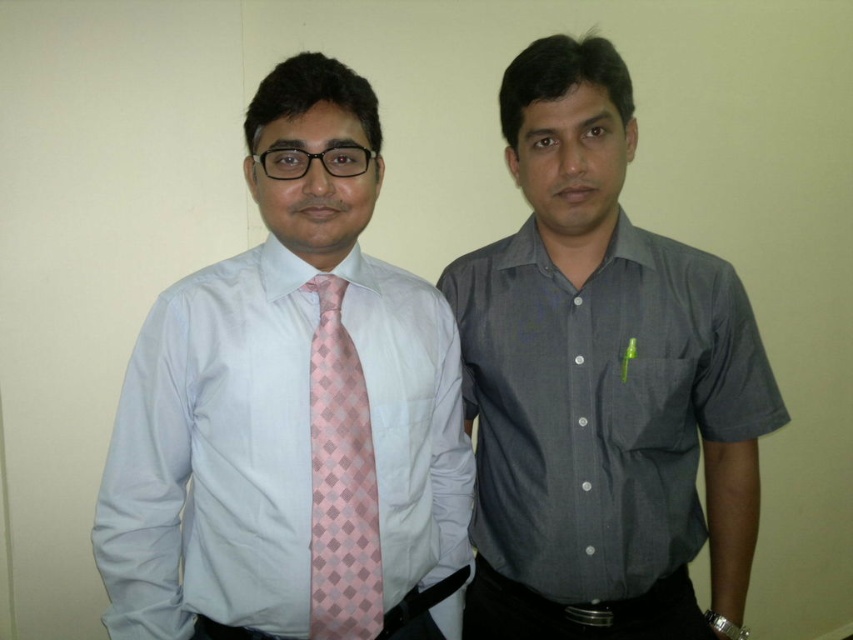
Measure the distance between point (583, 173) and camera.

A distance of 3.53 feet exists between point (583, 173) and camera.

Is dark gray shirt at center thinner than pink silk tie at left?

No, dark gray shirt at center is not thinner than pink silk tie at left.

Between point (692, 500) and point (335, 541), which one is positioned behind?

The point (692, 500) is more distant.

Locate an element on the screen. The height and width of the screenshot is (640, 853). dark gray shirt at center is located at coordinates (601, 385).

Does dark gray shirt at center have a greater width compared to black leather belt at lower center?

Correct, the width of dark gray shirt at center exceeds that of black leather belt at lower center.

Is point (602, 211) closer to viewer compared to point (583, 609)?

Yes.

Locate an element on the screen. dark gray shirt at center is located at coordinates (601, 385).

Can you confirm if matte pink tie at left is wider than black leather belt at lower center?

Correct, the width of matte pink tie at left exceeds that of black leather belt at lower center.

Can you confirm if matte pink tie at left is thinner than black leather belt at lower center?

No, matte pink tie at left is not thinner than black leather belt at lower center.

Which is behind, point (318, 355) or point (704, 630)?

The point (704, 630) is more distant.

The height and width of the screenshot is (640, 853). I want to click on matte pink tie at left, so click(x=291, y=412).